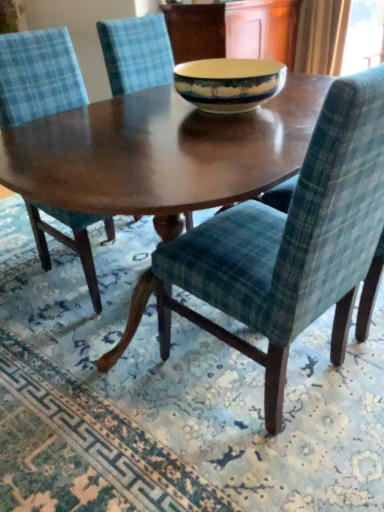
Question: In the image, is velvet green chair at center, which appears as the 1th chair when viewed from the right, on the left side or the right side of green plaid fabric at lower right?

Choices:
 (A) left
 (B) right

Answer: (B)

Question: In the image, is velvet green chair at center, which appears as the 1th chair when viewed from the right, positioned in front of or behind green plaid fabric at lower right?

Choices:
 (A) front
 (B) behind

Answer: (A)

Question: Which object is positioned farthest from the matte ceramic bowl at center?

Choices:
 (A) green plaid fabric at lower right
 (B) velvet green chair at center, which appears as the 1th chair when viewed from the right
 (C) velvet blue chair at center, which ranks as the first chair in left-to-right order
 (D) velvet blue chair at center, which ranks as the 2th chair in left-to-right order

Answer: (A)

Question: Estimate the real-world distances between objects in this image. Which object is farther from the matte ceramic bowl at center?

Choices:
 (A) velvet blue chair at center, which ranks as the 2th chair in left-to-right order
 (B) green plaid fabric at lower right
 (C) velvet blue chair at center, which ranks as the first chair in left-to-right order
 (D) velvet green chair at center, which appears as the 1th chair when viewed from the right

Answer: (B)